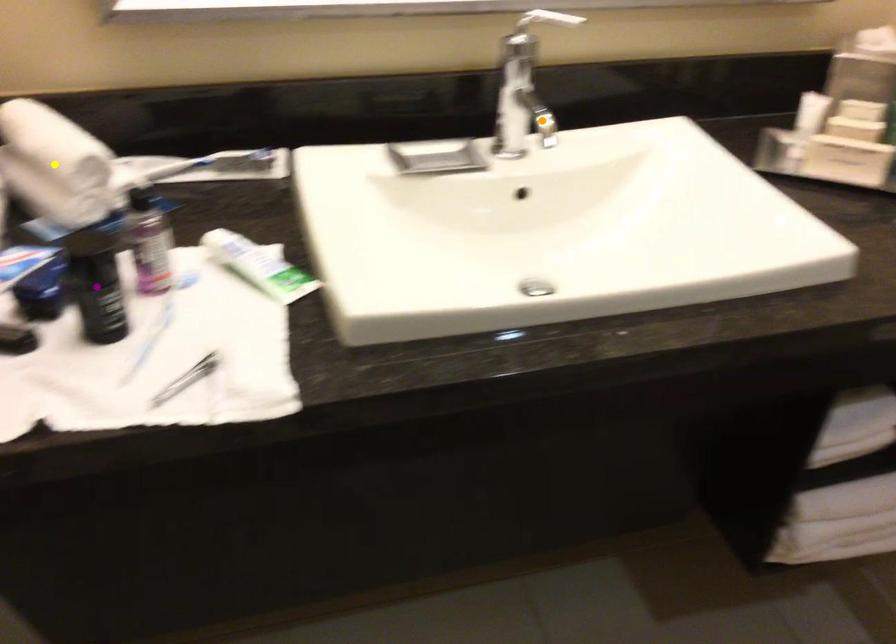
Order these from nearest to farthest:
1. orange point
2. yellow point
3. purple point

purple point
yellow point
orange point